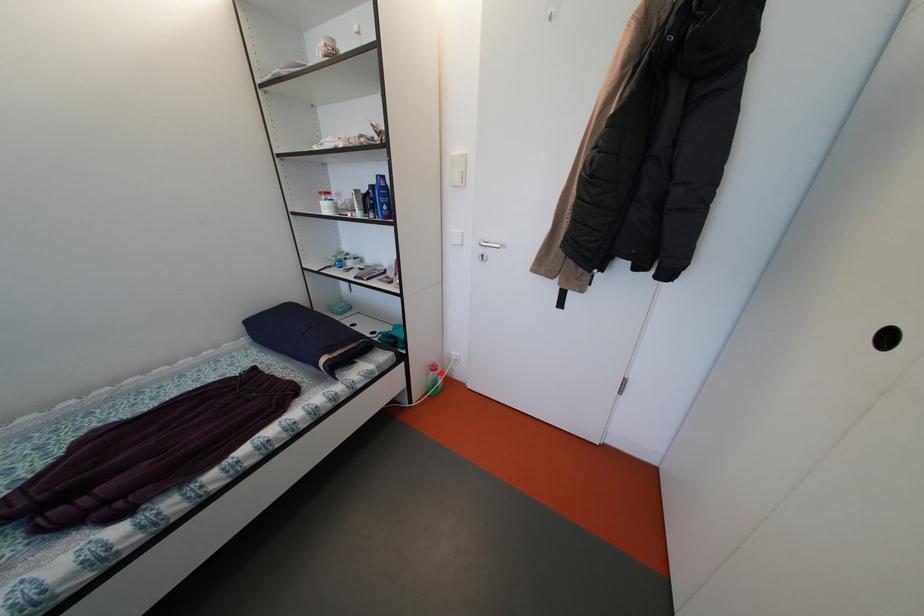
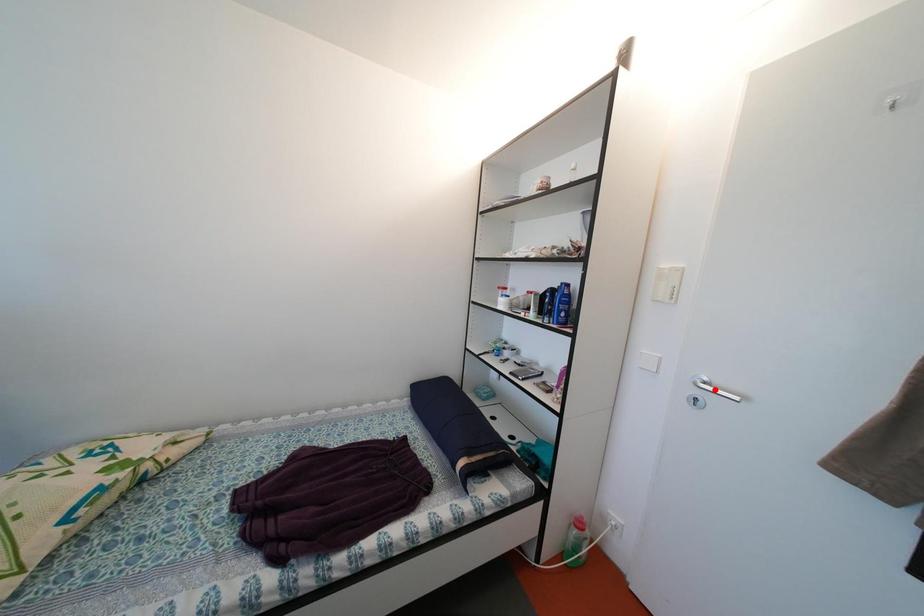
I am providing you with two images of the same scene from different viewpoints. A red point is marked on the first image and another point is marked on the second image. Is the marked point in image1 the same physical position as the marked point in image2?

No